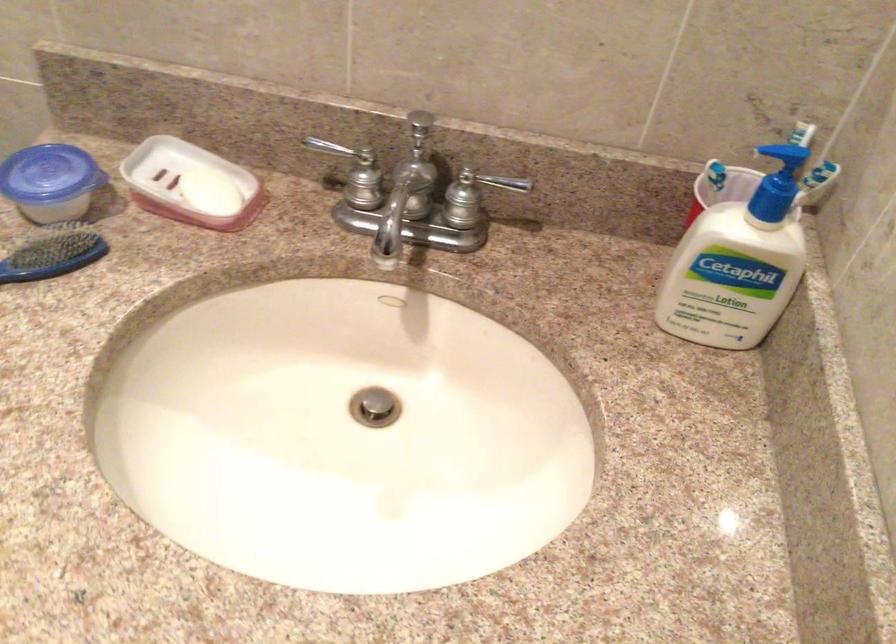
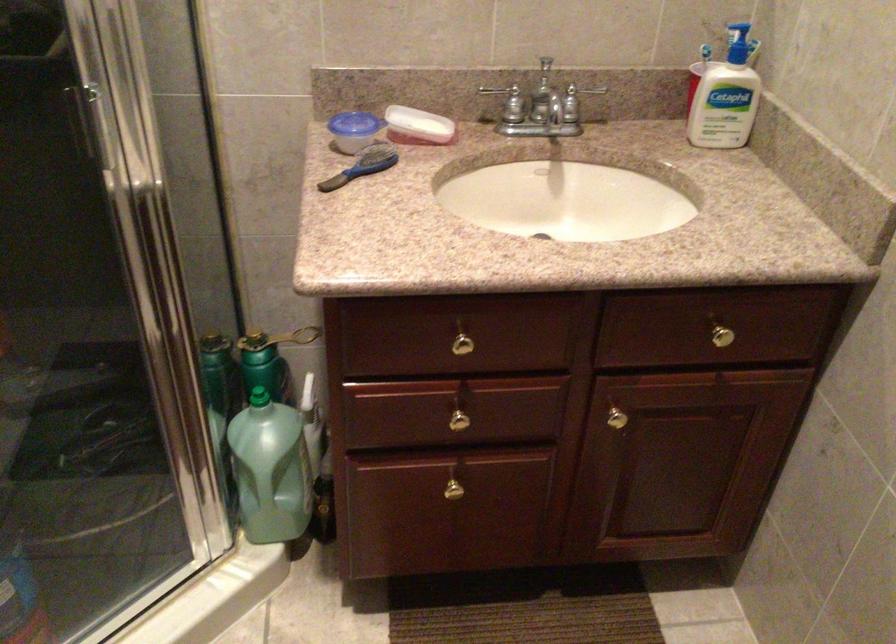
Find the pixel in the second image that matches pixel 819 129 in the first image.

(739, 35)